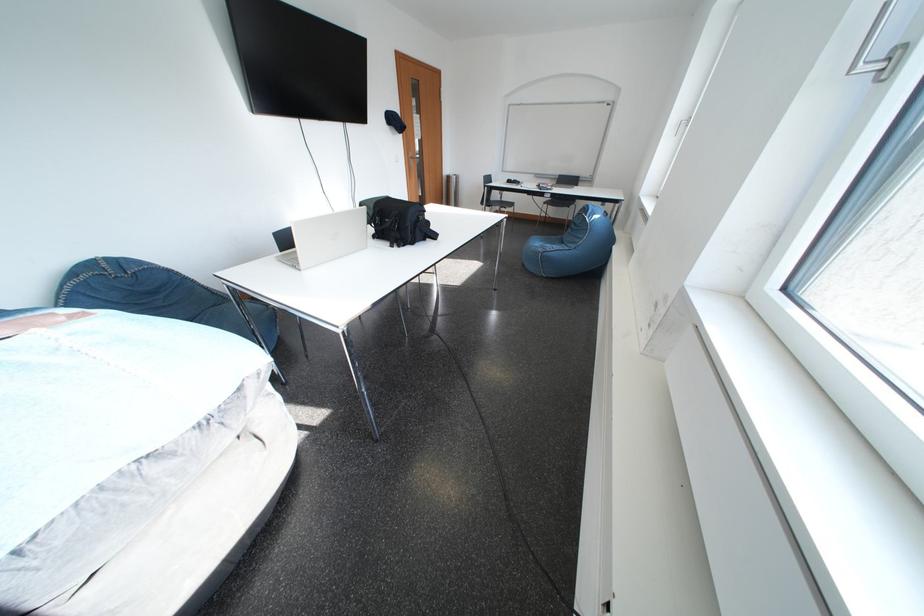
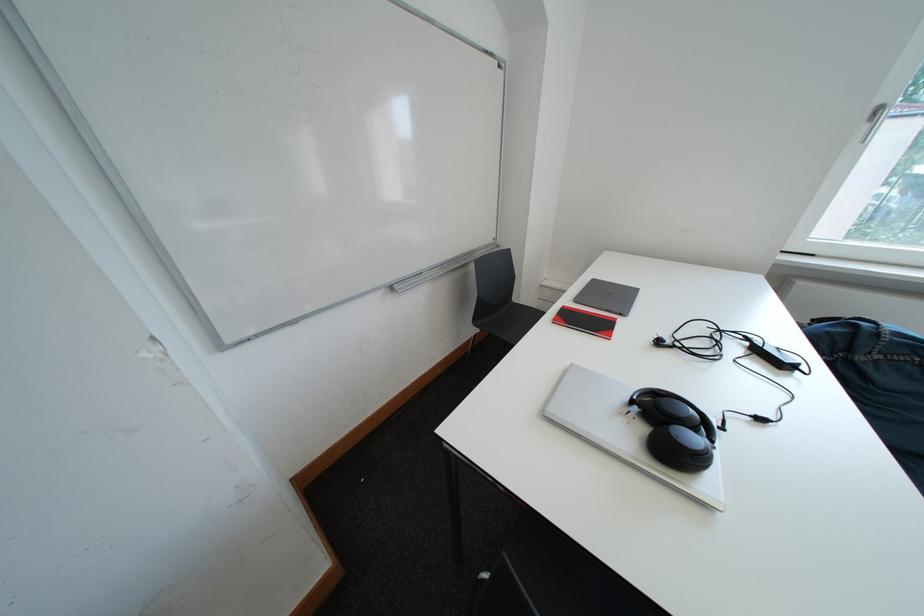
Question: I am providing you with two images of the same scene from different viewpoints. Please identify which objects are invisible in image2.

Choices:
 (A) silver closed laptop
 (B) chair sitting surface
 (C) white window handle
 (D) small green saucer

Answer: (B)